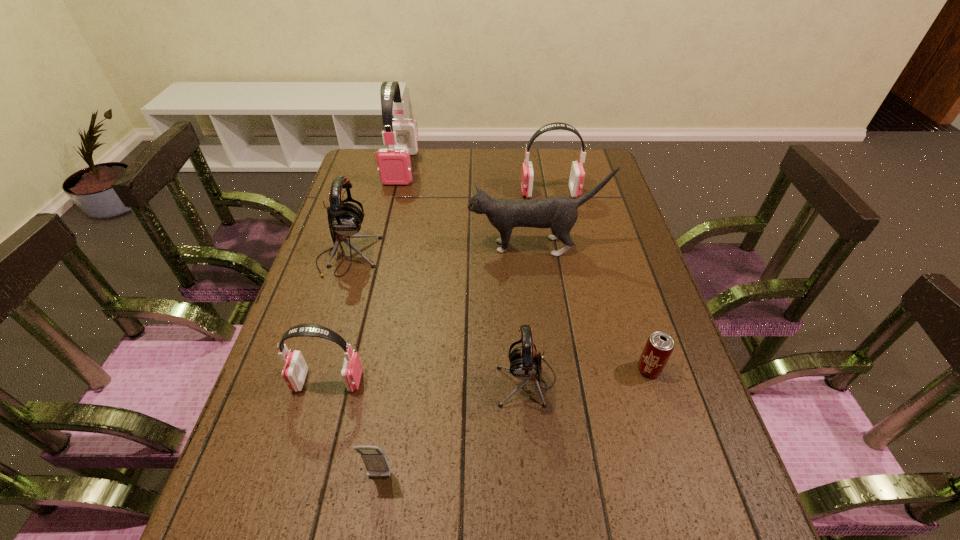
Locate an element on the screen. vacant region at the left edge of the desktop is located at coordinates (308, 483).

Image resolution: width=960 pixels, height=540 pixels. In the image, there is a desktop. Find the location of `vacant space at the right edge`. vacant space at the right edge is located at coordinates (643, 328).

Find the location of a particular element. The height and width of the screenshot is (540, 960). vacant space at the far right corner is located at coordinates (566, 179).

You are a GUI agent. You are given a task and a screenshot of the screen. Output one action in this format:
    pyautogui.click(x=<x>, y=<y>)
    Task: Click on the vacant space that's between the rightmost pink earphone and the second shortest object
    The image size is (960, 540).
    Given the screenshot: What is the action you would take?
    pyautogui.click(x=465, y=335)

At what (x,y) coordinates should I click in order to perform the action: click on free space between the second smallest pink earphone and the left black earphone. Please return your answer as a coordinate pair (x, y). The image size is (960, 540). Looking at the image, I should click on (449, 225).

Identify the location of vacant space that is in between the biggest pink earphone and the cellular telephone. The width and height of the screenshot is (960, 540). (390, 322).

At what (x,y) coordinates should I click in order to perform the action: click on unoccupied position between the nearer black earphone and the beer can. Please return your answer as a coordinate pair (x, y). The height and width of the screenshot is (540, 960). Looking at the image, I should click on (588, 375).

At what (x,y) coordinates should I click in order to perform the action: click on vacant space in between the shortest object and the nearest pink earphone. Please return your answer as a coordinate pair (x, y). Image resolution: width=960 pixels, height=540 pixels. Looking at the image, I should click on (489, 375).

You are a GUI agent. You are given a task and a screenshot of the screen. Output one action in this format:
    pyautogui.click(x=<x>, y=<y>)
    Task: Click on the free spot between the fifth object from right to left and the nearest pink earphone
    The height and width of the screenshot is (540, 960).
    Given the screenshot: What is the action you would take?
    pyautogui.click(x=353, y=429)

Where is `free spot between the shortest object and the nearest pink earphone`? This screenshot has height=540, width=960. free spot between the shortest object and the nearest pink earphone is located at coordinates (489, 375).